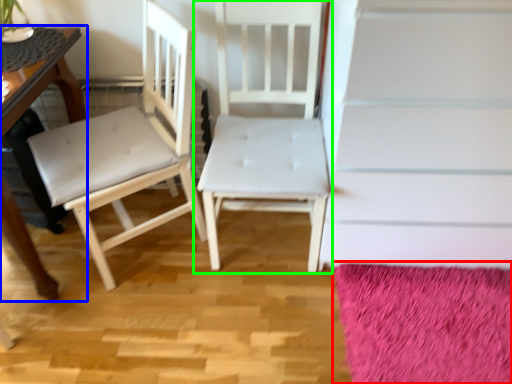
Question: Based on their relative distances, which object is farther from mat (highlighted by a red box)? Choose from table (highlighted by a blue box) and chair (highlighted by a green box).

Choices:
 (A) table
 (B) chair

Answer: (A)